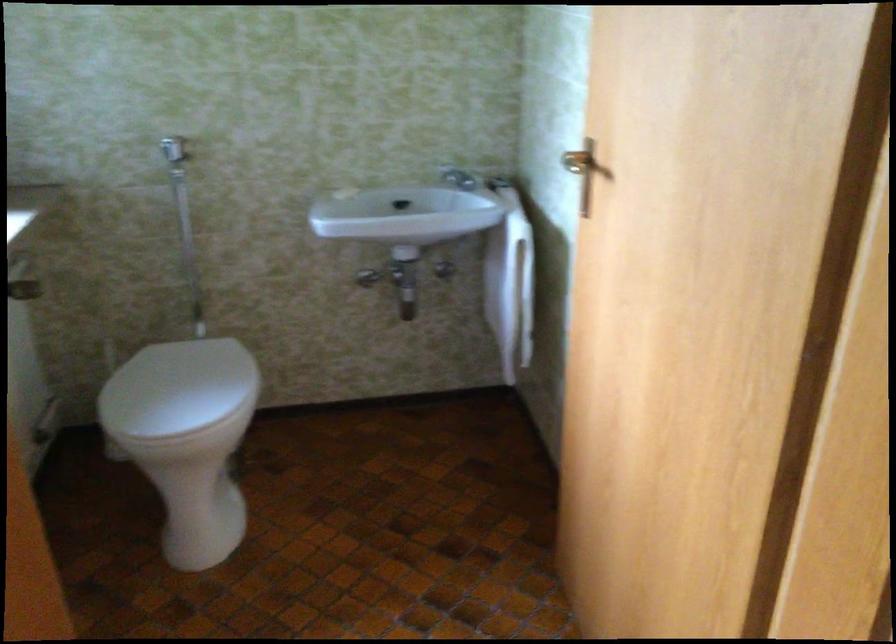
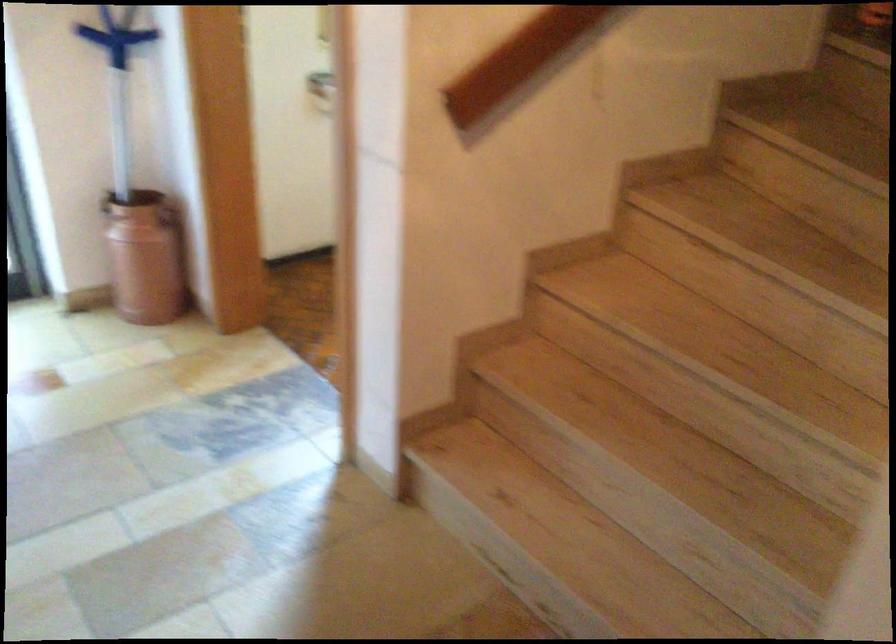
Question: I am providing you with two images of the same scene from different viewpoints. Please identify which objects are invisible in image2.

Choices:
 (A) wooden stair handrail
 (B) white toilet lid
 (C) orange spray bottle
 (D) container handle

Answer: (B)